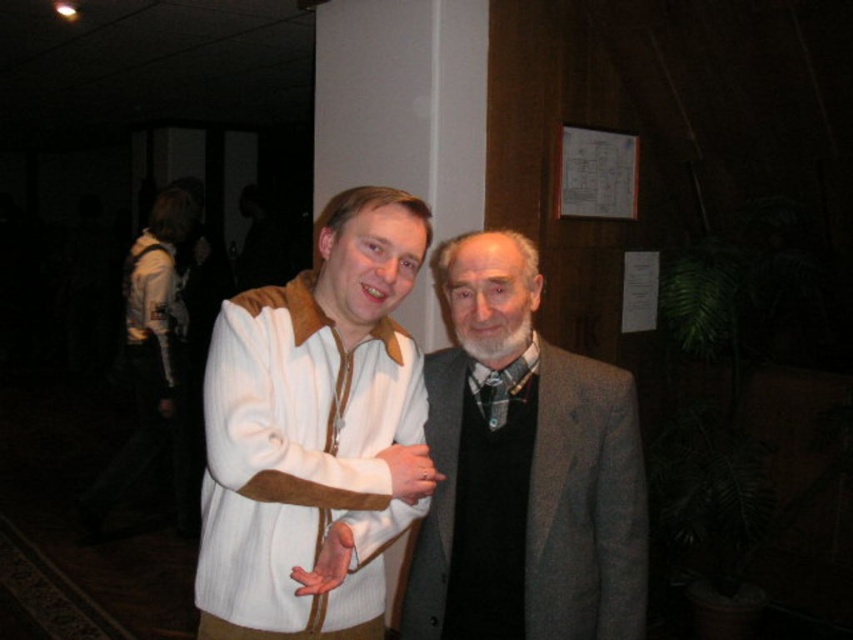
Can you confirm if white textured sweater at center is wider than gray wool suit at center?

Incorrect, white textured sweater at center's width does not surpass gray wool suit at center's.

Is white textured sweater at center bigger than gray wool suit at center?

Indeed, white textured sweater at center has a larger size compared to gray wool suit at center.

At what (x,y) coordinates should I click in order to perform the action: click on white textured sweater at center. Please return your answer as a coordinate pair (x, y). Looking at the image, I should click on (315, 433).

The image size is (853, 640). What are the coordinates of `white textured sweater at center` in the screenshot? It's located at (315, 433).

Which is more to the right, white textured sweater at center or black wool dress at center?

black wool dress at center

Is point (244, 529) closer to viewer compared to point (527, 387)?

Yes, it is.

The height and width of the screenshot is (640, 853). Identify the location of white textured sweater at center. (315, 433).

Is gray wool suit at center smaller than black wool dress at center?

No, gray wool suit at center is not smaller than black wool dress at center.

Is point (492, 552) positioned behind point (474, 394)?

No.

Identify the location of gray wool suit at center. pyautogui.click(x=524, y=470).